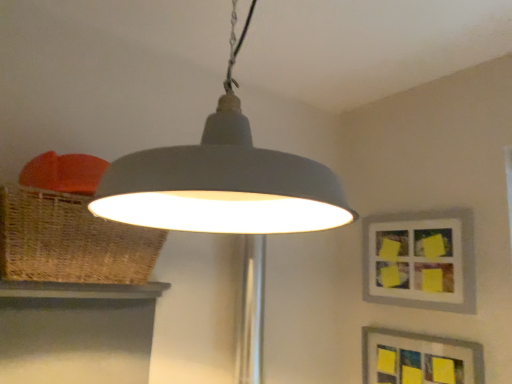
The image size is (512, 384). What do you see at coordinates (70, 241) in the screenshot?
I see `woven brown basket at left` at bounding box center [70, 241].

You are a GUI agent. You are given a task and a screenshot of the screen. Output one action in this format:
    pyautogui.click(x=<x>, y=<y>)
    Task: Click on the matte gray picture frame at upper right, the 1th picture frame viewed from the top
    Image resolution: width=512 pixels, height=384 pixels.
    Given the screenshot: What is the action you would take?
    pyautogui.click(x=421, y=260)

Describe the element at coordinates (225, 191) in the screenshot. I see `matte gray lampshade at center` at that location.

Locate an element on the screen. Image resolution: width=512 pixels, height=384 pixels. matte gray picture frame at lower right, which is counted as the second picture frame, starting from the top is located at coordinates (418, 359).

You are a GUI agent. You are given a task and a screenshot of the screen. Output one action in this format:
    pyautogui.click(x=<x>, y=<y>)
    Task: Click on the woven brown basket at left
    
    Given the screenshot: What is the action you would take?
    pyautogui.click(x=70, y=241)

Consider the image. Between matte gray picture frame at lower right, which is counted as the second picture frame, starting from the top, and woven brown basket at left, which one has larger width?

With larger width is woven brown basket at left.

From a real-world perspective, count 2nd picture frames downward from the woven brown basket at left and point to it. Please provide its 2D coordinates.

[(418, 359)]

Can you tell me how much matte gray picture frame at lower right, the 1th picture frame positioned from the bottom, and woven brown basket at left differ in facing direction?

90 degrees separate the facing orientations of matte gray picture frame at lower right, the 1th picture frame positioned from the bottom, and woven brown basket at left.

Is matte gray picture frame at lower right, the 1th picture frame positioned from the bottom, at the right side of matte gray picture frame at upper right, the 1th picture frame viewed from the top?

No, matte gray picture frame at lower right, the 1th picture frame positioned from the bottom, is not to the right of matte gray picture frame at upper right, the 1th picture frame viewed from the top.

Is matte gray picture frame at lower right, the 1th picture frame positioned from the bottom, placed right next to matte gray picture frame at upper right, marked as the 2th picture frame in a bottom-to-top arrangement?

No, matte gray picture frame at lower right, the 1th picture frame positioned from the bottom, is not beside matte gray picture frame at upper right, marked as the 2th picture frame in a bottom-to-top arrangement.

Does matte gray picture frame at lower right, the 1th picture frame positioned from the bottom, have a greater width compared to matte gray picture frame at upper right, the 1th picture frame viewed from the top?

No, matte gray picture frame at lower right, the 1th picture frame positioned from the bottom, is not wider than matte gray picture frame at upper right, the 1th picture frame viewed from the top.

Is point (109, 244) farther from viewer compared to point (475, 365)?

That is False.

Between woven brown basket at left and matte gray picture frame at lower right, the 1th picture frame positioned from the bottom, which one appears on the right side from the viewer's perspective?

matte gray picture frame at lower right, the 1th picture frame positioned from the bottom, is more to the right.

From the image's perspective, which one is positioned higher, woven brown basket at left or matte gray picture frame at lower right, the 1th picture frame positioned from the bottom?

woven brown basket at left, from the image's perspective.

Based on the photo, which is correct: woven brown basket at left is inside matte gray picture frame at lower right, the 1th picture frame positioned from the bottom, or outside of it?

woven brown basket at left is not enclosed by matte gray picture frame at lower right, the 1th picture frame positioned from the bottom.

Which is further, (403, 359) or (231, 152)?

The point (403, 359) is more distant.

Identify the location of picture frame that is the 2nd object located below the matte gray lampshade at center (from the image's perspective). (418, 359).

From the image's perspective, is matte gray picture frame at lower right, the 1th picture frame positioned from the bottom, positioned above or below matte gray lampshade at center?

Based on their image positions, matte gray picture frame at lower right, the 1th picture frame positioned from the bottom, is located beneath matte gray lampshade at center.

Is matte gray picture frame at lower right, the 1th picture frame positioned from the bottom, aimed at matte gray lampshade at center?

No, matte gray picture frame at lower right, the 1th picture frame positioned from the bottom, is not aimed at matte gray lampshade at center.

Does point (394, 223) appear closer or farther from the camera than point (230, 149)?

Point (394, 223) appears to be farther away from the viewer than point (230, 149).

What's the angular difference between matte gray picture frame at upper right, the 1th picture frame viewed from the top, and matte gray lampshade at center's facing directions?

The angle between the facing direction of matte gray picture frame at upper right, the 1th picture frame viewed from the top, and the facing direction of matte gray lampshade at center is 5.44 degrees.

Which of these two, matte gray picture frame at upper right, marked as the 2th picture frame in a bottom-to-top arrangement, or matte gray lampshade at center, stands shorter?

Standing shorter between the two is matte gray picture frame at upper right, marked as the 2th picture frame in a bottom-to-top arrangement.

Is matte gray picture frame at upper right, the 1th picture frame viewed from the top, turned away from matte gray lampshade at center?

matte gray picture frame at upper right, the 1th picture frame viewed from the top, does not have its back to matte gray lampshade at center.

Do you think matte gray picture frame at upper right, marked as the 2th picture frame in a bottom-to-top arrangement, is within matte gray picture frame at lower right, which is counted as the second picture frame, starting from the top, or outside of it?

matte gray picture frame at upper right, marked as the 2th picture frame in a bottom-to-top arrangement, exists outside the volume of matte gray picture frame at lower right, which is counted as the second picture frame, starting from the top.

Is matte gray picture frame at upper right, marked as the 2th picture frame in a bottom-to-top arrangement, beside matte gray picture frame at lower right, which is counted as the second picture frame, starting from the top?

matte gray picture frame at upper right, marked as the 2th picture frame in a bottom-to-top arrangement, is not next to matte gray picture frame at lower right, which is counted as the second picture frame, starting from the top, and they're not touching.

From a real-world perspective, is matte gray picture frame at upper right, the 1th picture frame viewed from the top, physically located above or below matte gray picture frame at lower right, which is counted as the second picture frame, starting from the top?

matte gray picture frame at upper right, the 1th picture frame viewed from the top, is above matte gray picture frame at lower right, which is counted as the second picture frame, starting from the top.

This screenshot has width=512, height=384. Find the location of `picture frame that appears on the right of matte gray picture frame at lower right, which is counted as the second picture frame, starting from the top`. picture frame that appears on the right of matte gray picture frame at lower right, which is counted as the second picture frame, starting from the top is located at coordinates (x=421, y=260).

Could you tell me if woven brown basket at left is turned towards matte gray lampshade at center?

Yes, woven brown basket at left faces towards matte gray lampshade at center.

Does point (137, 262) come in front of point (100, 201)?

That is False.

Is matte gray lampshade at center completely or partially inside woven brown basket at left?

No, woven brown basket at left does not contain matte gray lampshade at center.

From their relative heights in the image, would you say woven brown basket at left is taller or shorter than matte gray lampshade at center?

In the image, woven brown basket at left appears to be shorter than matte gray lampshade at center.

The height and width of the screenshot is (384, 512). I want to click on basket on the left side of matte gray picture frame at lower right, which is counted as the second picture frame, starting from the top, so click(x=70, y=241).

The image size is (512, 384). What are the coordinates of `picture frame located above the matte gray picture frame at lower right, which is counted as the second picture frame, starting from the top (from a real-world perspective)` in the screenshot? It's located at pos(421,260).

Which object lies further to the anchor point woven brown basket at left, matte gray picture frame at upper right, the 1th picture frame viewed from the top, or matte gray picture frame at lower right, the 1th picture frame positioned from the bottom?

matte gray picture frame at lower right, the 1th picture frame positioned from the bottom, is further to woven brown basket at left.

Which object lies nearer to the anchor point matte gray lampshade at center, matte gray picture frame at lower right, the 1th picture frame positioned from the bottom, or woven brown basket at left?

woven brown basket at left is positioned closer to the anchor matte gray lampshade at center.

Based on the photo, from the image, which object appears to be farther from matte gray lampshade at center, matte gray picture frame at upper right, the 1th picture frame viewed from the top, or matte gray picture frame at lower right, the 1th picture frame positioned from the bottom?

The object further to matte gray lampshade at center is matte gray picture frame at lower right, the 1th picture frame positioned from the bottom.

Which object lies nearer to the anchor point matte gray lampshade at center, matte gray picture frame at lower right, the 1th picture frame positioned from the bottom, or matte gray picture frame at upper right, marked as the 2th picture frame in a bottom-to-top arrangement?

matte gray picture frame at upper right, marked as the 2th picture frame in a bottom-to-top arrangement, is closer to matte gray lampshade at center.

From the image, which object appears to be nearer to matte gray picture frame at lower right, which is counted as the second picture frame, starting from the top, woven brown basket at left or matte gray lampshade at center?

matte gray lampshade at center is closer to matte gray picture frame at lower right, which is counted as the second picture frame, starting from the top.

From the image, which object appears to be nearer to matte gray picture frame at upper right, the 1th picture frame viewed from the top, matte gray lampshade at center or woven brown basket at left?

The object closer to matte gray picture frame at upper right, the 1th picture frame viewed from the top, is matte gray lampshade at center.

From the image, which object appears to be farther from woven brown basket at left, matte gray picture frame at lower right, the 1th picture frame positioned from the bottom, or matte gray lampshade at center?

The object further to woven brown basket at left is matte gray picture frame at lower right, the 1th picture frame positioned from the bottom.

From the picture: From the image, which object appears to be farther from matte gray picture frame at lower right, which is counted as the second picture frame, starting from the top, matte gray picture frame at upper right, marked as the 2th picture frame in a bottom-to-top arrangement, or matte gray lampshade at center?

Among the two, matte gray lampshade at center is located further to matte gray picture frame at lower right, which is counted as the second picture frame, starting from the top.

Locate an element on the screen. The image size is (512, 384). picture frame located between matte gray lampshade at center and matte gray picture frame at upper right, the 1th picture frame viewed from the top, in the depth direction is located at coordinates (418, 359).

The height and width of the screenshot is (384, 512). Find the location of `lamp between woven brown basket at left and matte gray picture frame at upper right, marked as the 2th picture frame in a bottom-to-top arrangement`. lamp between woven brown basket at left and matte gray picture frame at upper right, marked as the 2th picture frame in a bottom-to-top arrangement is located at coordinates (225, 191).

At what (x,y) coordinates should I click in order to perform the action: click on picture frame between woven brown basket at left and matte gray picture frame at upper right, the 1th picture frame viewed from the top. Please return your answer as a coordinate pair (x, y). The image size is (512, 384). Looking at the image, I should click on (418, 359).

This screenshot has width=512, height=384. Find the location of `lamp between woven brown basket at left and matte gray picture frame at lower right, the 1th picture frame positioned from the bottom`. lamp between woven brown basket at left and matte gray picture frame at lower right, the 1th picture frame positioned from the bottom is located at coordinates (225, 191).